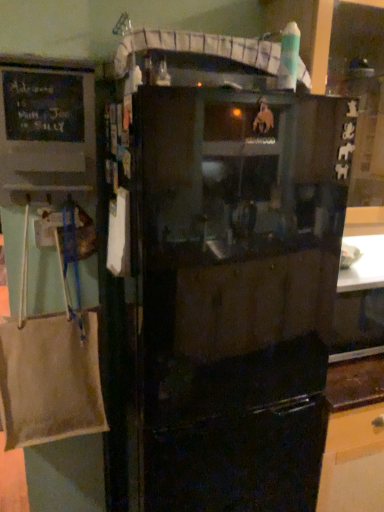
What do you see at coordinates (228, 303) in the screenshot? The image size is (384, 512). I see `black matte refrigerator at center` at bounding box center [228, 303].

The width and height of the screenshot is (384, 512). What are the coordinates of `black matte refrigerator at center` in the screenshot? It's located at (228, 303).

This screenshot has width=384, height=512. What do you see at coordinates (47, 121) in the screenshot?
I see `chalkboard matte black at left` at bounding box center [47, 121].

Where is `chalkboard matte black at left`? The height and width of the screenshot is (512, 384). chalkboard matte black at left is located at coordinates (47, 121).

This screenshot has width=384, height=512. I want to click on black matte refrigerator at center, so click(x=228, y=303).

Which object is positioned more to the left, chalkboard matte black at left or black matte refrigerator at center?

From the viewer's perspective, chalkboard matte black at left appears more on the left side.

In the image, is chalkboard matte black at left positioned in front of or behind black matte refrigerator at center?

chalkboard matte black at left is positioned farther from the viewer than black matte refrigerator at center.

Consider the image. Which is farther from the camera, (70, 156) or (219, 119)?

The point (70, 156) is farther.

From the image's perspective, is chalkboard matte black at left located beneath black matte refrigerator at center?

No, from the image's perspective, chalkboard matte black at left is not below black matte refrigerator at center.

From a real-world perspective, is chalkboard matte black at left positioned above or below black matte refrigerator at center?

chalkboard matte black at left is situated higher than black matte refrigerator at center in the real world.

Considering the sizes of objects chalkboard matte black at left and black matte refrigerator at center in the image provided, who is wider, chalkboard matte black at left or black matte refrigerator at center?

black matte refrigerator at center.

In terms of height, does chalkboard matte black at left look taller or shorter compared to black matte refrigerator at center?

Clearly, chalkboard matte black at left is shorter compared to black matte refrigerator at center.

Is chalkboard matte black at left smaller than black matte refrigerator at center?

Yes.

Could black matte refrigerator at center be considered to be inside chalkboard matte black at left?

That's incorrect, black matte refrigerator at center is not inside chalkboard matte black at left.

Is chalkboard matte black at left with black matte refrigerator at center?

They are not placed beside each other.

In the scene shown: Is chalkboard matte black at left oriented towards black matte refrigerator at center?

No, chalkboard matte black at left is not facing towards black matte refrigerator at center.

Where is `bulletin board that is on the left side of black matte refrigerator at center`? The height and width of the screenshot is (512, 384). bulletin board that is on the left side of black matte refrigerator at center is located at coordinates [47, 121].

Is black matte refrigerator at center to the left or to the right of chalkboard matte black at left in the image?

black matte refrigerator at center is to the right of chalkboard matte black at left.

Which object is closer to the camera taking this photo, black matte refrigerator at center or chalkboard matte black at left?

black matte refrigerator at center is more forward.

Is point (269, 264) positioned after point (59, 110)?

No, (269, 264) is closer to viewer.

From the image's perspective, does black matte refrigerator at center appear lower than chalkboard matte black at left?

Yes, from the image's perspective, black matte refrigerator at center is beneath chalkboard matte black at left.

From a real-world perspective, is black matte refrigerator at center physically above chalkboard matte black at left?

Incorrect, from a real-world perspective, black matte refrigerator at center is lower than chalkboard matte black at left.

Considering the relative sizes of black matte refrigerator at center and chalkboard matte black at left in the image provided, is black matte refrigerator at center thinner than chalkboard matte black at left?

In fact, black matte refrigerator at center might be wider than chalkboard matte black at left.

Is black matte refrigerator at center taller than chalkboard matte black at left?

Yes.

Can you confirm if black matte refrigerator at center is bigger than chalkboard matte black at left?

Yes.

Can chalkboard matte black at left be found inside black matte refrigerator at center?

Actually, chalkboard matte black at left is outside black matte refrigerator at center.

Is black matte refrigerator at center directly adjacent to chalkboard matte black at left?

black matte refrigerator at center and chalkboard matte black at left are not in contact.

Is black matte refrigerator at center facing away from chalkboard matte black at left?

No, black matte refrigerator at center's orientation is not away from chalkboard matte black at left.

Can you tell me how much black matte refrigerator at center and chalkboard matte black at left differ in facing direction?

There is a 0.088-degree angle between the facing directions of black matte refrigerator at center and chalkboard matte black at left.

Locate an element on the screen. This screenshot has height=512, width=384. refrigerator that appears in front of the chalkboard matte black at left is located at coordinates (228, 303).

You are a GUI agent. You are given a task and a screenshot of the screen. Output one action in this format:
    pyautogui.click(x=<x>, y=<y>)
    Task: Click on the bulletin board behind the black matte refrigerator at center
    
    Given the screenshot: What is the action you would take?
    pyautogui.click(x=47, y=121)

Where is `refrigerator on the right of chalkboard matte black at left`? This screenshot has height=512, width=384. refrigerator on the right of chalkboard matte black at left is located at coordinates (228, 303).